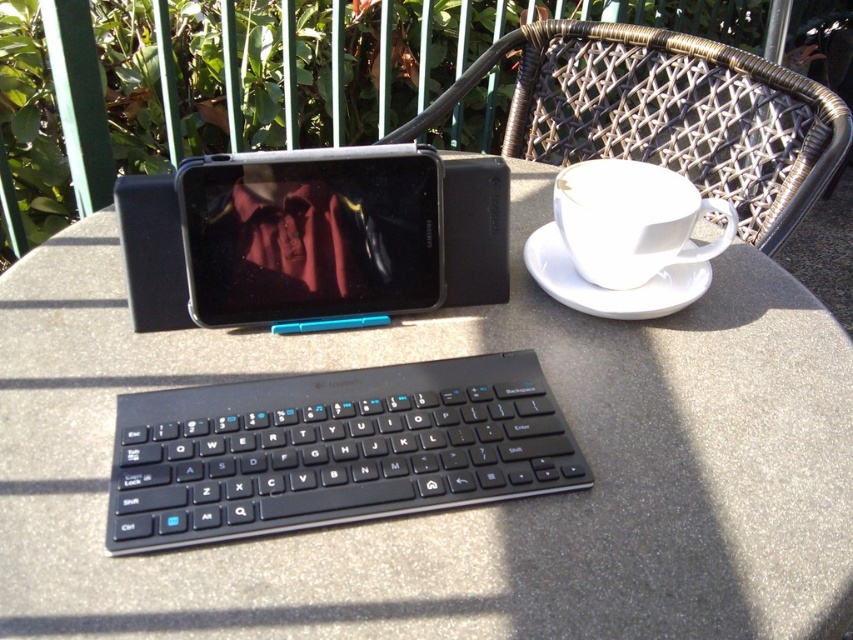
You are planning to place a 10cm wide book on the table between the woven rattan chair at upper right and the white ceramic cup at upper right. Based on the objects present, will the book fit between them?

The woven rattan chair at upper right is wider than the white ceramic cup at upper right, but the exact width difference isn

You are setting up a coffee station and need to place the white ceramic cup at upper right and white ceramic saucer at right correctly. According to the image, which item should be positioned to the left of the other?

The white ceramic saucer at right should be positioned to the left of the white ceramic cup at upper right because the cup is to the right of the saucer.

You are sitting in a woven rattan chair at upper right and want to reach the white ceramic cup at upper right. Is the cup within your immediate reach?

The woven rattan chair at upper right is positioned over white ceramic cup at upper right, so the cup is directly beneath the chair. Since you are sitting in the chair, the cup is likely within your immediate reach.